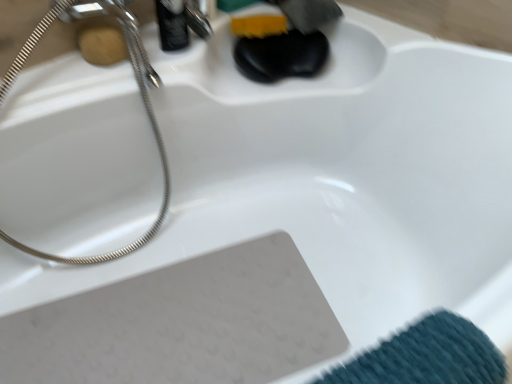
Question: Is wooden soap at upper left positioned far away from satin nickel shower head at upper left?

Choices:
 (A) yes
 (B) no

Answer: (B)

Question: Would you say satin nickel shower head at upper left is part of wooden soap at upper left's contents?

Choices:
 (A) no
 (B) yes

Answer: (A)

Question: Is wooden soap at upper left at the right side of satin nickel shower head at upper left?

Choices:
 (A) yes
 (B) no

Answer: (A)

Question: From a real-world perspective, is wooden soap at upper left located beneath satin nickel shower head at upper left?

Choices:
 (A) yes
 (B) no

Answer: (B)

Question: Can you confirm if wooden soap at upper left is positioned to the left of satin nickel shower head at upper left?

Choices:
 (A) no
 (B) yes

Answer: (A)

Question: In the image, is wooden soap at upper left on the left side or the right side of satin nickel shower head at upper left?

Choices:
 (A) left
 (B) right

Answer: (B)

Question: From a real-world perspective, is wooden soap at upper left positioned above or below satin nickel shower head at upper left?

Choices:
 (A) above
 (B) below

Answer: (A)

Question: From their relative heights in the image, would you say wooden soap at upper left is taller or shorter than satin nickel shower head at upper left?

Choices:
 (A) short
 (B) tall

Answer: (A)

Question: Considering the positions of wooden soap at upper left and satin nickel shower head at upper left in the image, is wooden soap at upper left bigger or smaller than satin nickel shower head at upper left?

Choices:
 (A) big
 (B) small

Answer: (B)

Question: From the image's perspective, is satin nickel shower head at upper left located above or below polished chrome faucet at upper center?

Choices:
 (A) above
 (B) below

Answer: (B)

Question: In terms of height, does satin nickel shower head at upper left look taller or shorter compared to polished chrome faucet at upper center?

Choices:
 (A) short
 (B) tall

Answer: (B)

Question: Is satin nickel shower head at upper left bigger or smaller than polished chrome faucet at upper center?

Choices:
 (A) big
 (B) small

Answer: (A)

Question: Would you say satin nickel shower head at upper left is inside or outside polished chrome faucet at upper center?

Choices:
 (A) inside
 (B) outside

Answer: (B)

Question: Considering the positions of wooden soap at upper left and polished chrome faucet at upper center in the image, is wooden soap at upper left bigger or smaller than polished chrome faucet at upper center?

Choices:
 (A) small
 (B) big

Answer: (A)

Question: From the image's perspective, relative to polished chrome faucet at upper center, is wooden soap at upper left above or below?

Choices:
 (A) above
 (B) below

Answer: (B)